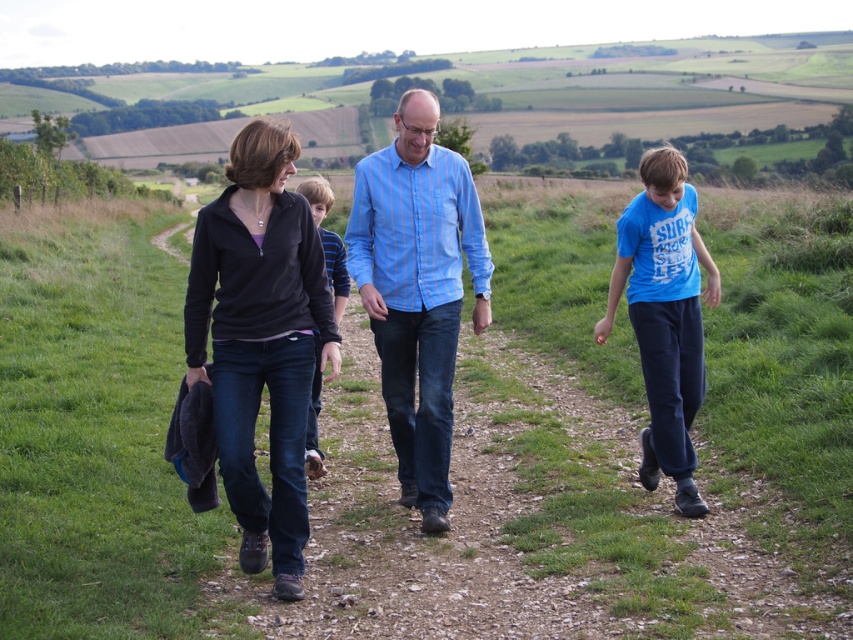
Question: Estimate the real-world distances between objects in this image. Which object is closer to the blue cotton shirt at right?

Choices:
 (A) matte black jacket at left
 (B) matte black jacket at center
 (C) striped cotton shirt at center

Answer: (A)

Question: Which is farther from the striped cotton shirt at center?

Choices:
 (A) blue striped shirt at center
 (B) matte black jacket at center
 (C) matte black jacket at left

Answer: (C)

Question: Is matte black jacket at center below blue striped shirt at center?

Choices:
 (A) yes
 (B) no

Answer: (B)

Question: Does matte black jacket at center have a greater width compared to blue striped shirt at center?

Choices:
 (A) no
 (B) yes

Answer: (A)

Question: Among these points, which one is nearest to the camera?

Choices:
 (A) (242, 408)
 (B) (440, 371)
 (C) (314, 385)
 (D) (399, 145)

Answer: (A)

Question: Does blue striped shirt at center have a larger size compared to blue cotton shirt at right?

Choices:
 (A) yes
 (B) no

Answer: (A)